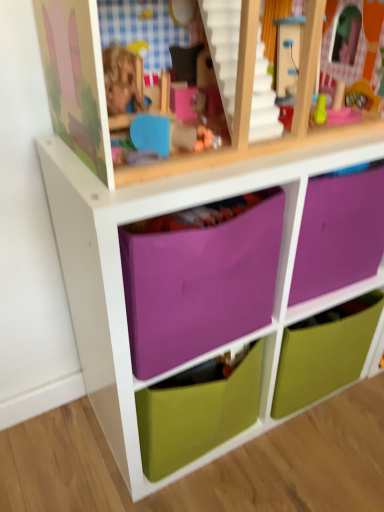
You are a GUI agent. You are given a task and a screenshot of the screen. Output one action in this format:
    pyautogui.click(x=<x>, y=<y>)
    Task: Click on the free space in front of green matte drawer at center, which is the 3th drawer in top-to-bottom order
    
    Given the screenshot: What is the action you would take?
    pyautogui.click(x=312, y=457)